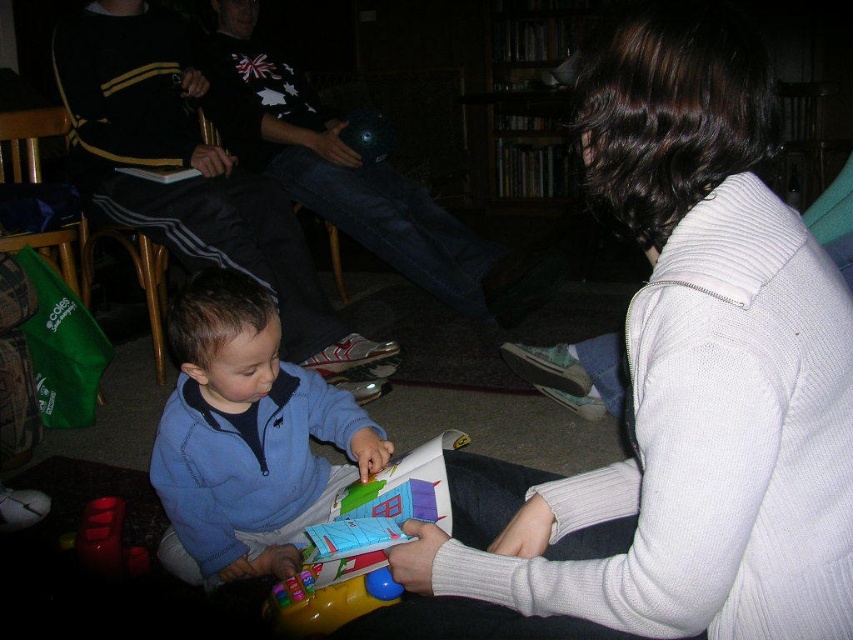
Question: Does plastic colorful toy at center have a larger size compared to rubberized red toy at lower left?

Choices:
 (A) no
 (B) yes

Answer: (B)

Question: Which of the following is the farthest from the observer?

Choices:
 (A) rubberized red toy at lower left
 (B) blue fleece jacket at center
 (C) white ribbed sweater at center
 (D) plastic colorful toy at center

Answer: (A)

Question: Where is plastic colorful toy at center located in relation to rubberized red toy at lower left in the image?

Choices:
 (A) right
 (B) left

Answer: (A)

Question: Based on their relative distances, which object is farther from the white ribbed sweater at center?

Choices:
 (A) rubberized red toy at lower left
 (B) plastic colorful toy at center

Answer: (A)

Question: Can you confirm if blue fleece jacket at center is positioned above rubberized red toy at lower left?

Choices:
 (A) no
 (B) yes

Answer: (B)

Question: Which of the following is the closest to the observer?

Choices:
 (A) (93, 554)
 (B) (381, 577)
 (C) (294, 474)
 (D) (440, 616)

Answer: (D)